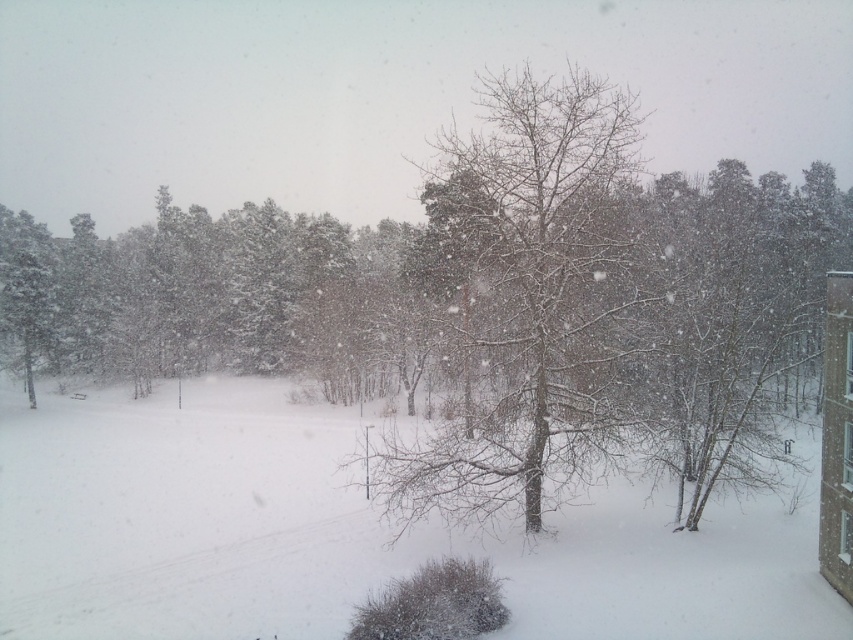
Does point (465, 164) come behind point (843, 544)?

That is True.

Can you confirm if snow-covered bare tree at center is bigger than transparent glass window at upper right?

Correct, snow-covered bare tree at center is larger in size than transparent glass window at upper right.

Find the location of a particular element. This screenshot has width=853, height=640. snow-covered bare tree at center is located at coordinates (527, 296).

Who is higher up, transparent glass window at right or clear glass window at upper right?

Positioned higher is clear glass window at upper right.

Who is lower down, transparent glass window at right or clear glass window at upper right?

Positioned lower is transparent glass window at right.

Does point (846, 444) come behind point (850, 355)?

That is True.

You are a GUI agent. You are given a task and a screenshot of the screen. Output one action in this format:
    pyautogui.click(x=<x>, y=<y>)
    Task: Click on the transparent glass window at right
    This screenshot has height=640, width=853.
    Given the screenshot: What is the action you would take?
    pyautogui.click(x=846, y=456)

Which is in front, point (543, 564) or point (848, 356)?

Point (848, 356) is in front.

Between white fluffy snow at center and clear glass window at upper right, which one appears on the right side from the viewer's perspective?

clear glass window at upper right

Identify the location of white fluffy snow at center. (346, 532).

Where is `white fluffy snow at center`? The height and width of the screenshot is (640, 853). white fluffy snow at center is located at coordinates (346, 532).